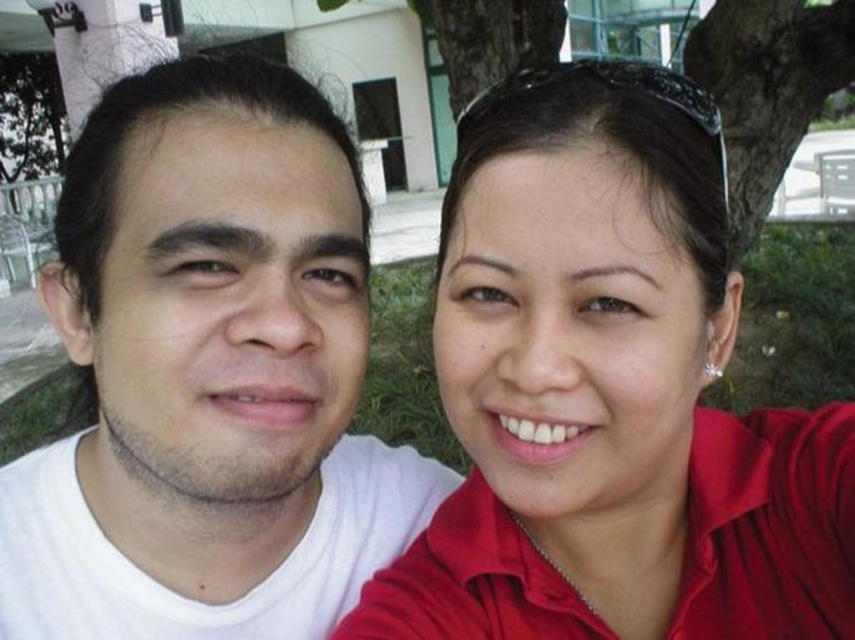
You are standing in a park and see two points marked in the image. The first point is at coordinates point (441, 244) and the second is at point (226, 147). If you were to walk from the first point to the second, would you be moving towards the tree trunk or away from it?

Based on the coordinates provided, point (441, 244) is behind point (226, 147). Since the tree trunk is part of the background in the scene, moving from the first point to the second would mean moving towards the tree trunk.